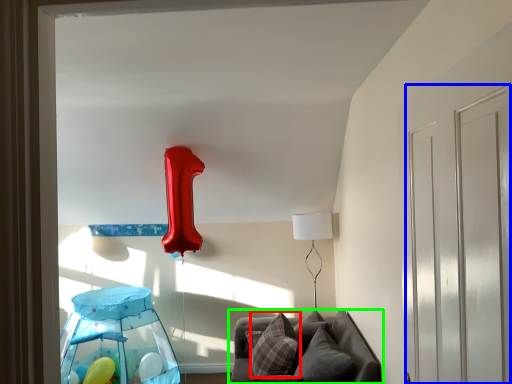
Question: Based on their relative distances, which object is nearer to pillow (highlighted by a red box)? Choose from glass door (highlighted by a blue box) and furniture (highlighted by a green box).

Choices:
 (A) glass door
 (B) furniture

Answer: (B)